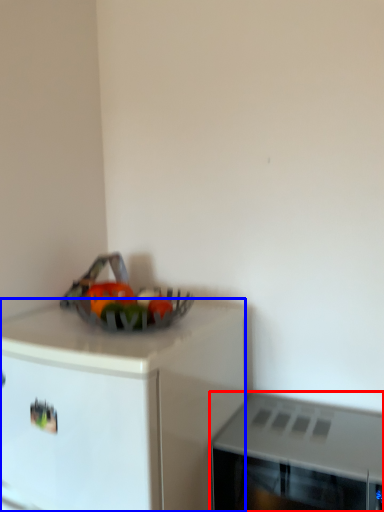
Question: Which object is closer to the camera taking this photo, microwave oven (highlighted by a red box) or cabinetry (highlighted by a blue box)?

Choices:
 (A) microwave oven
 (B) cabinetry

Answer: (B)